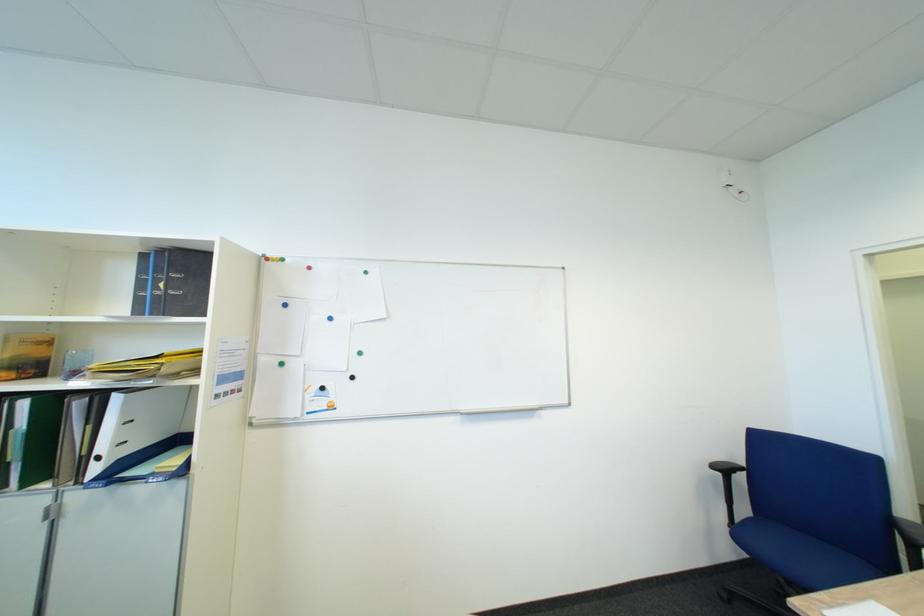
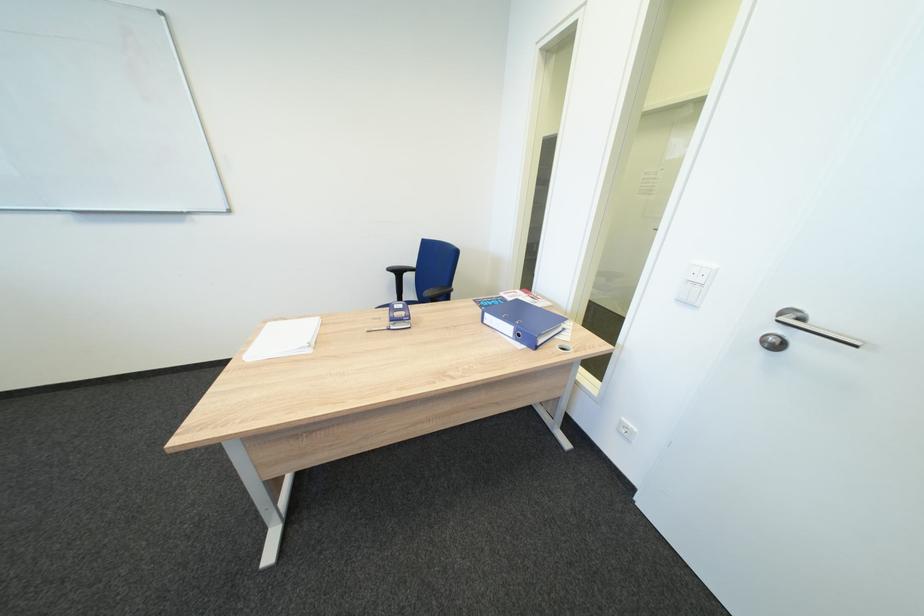
The point at (723,469) is marked in the first image. Where is the corresponding point in the second image?

(400, 270)